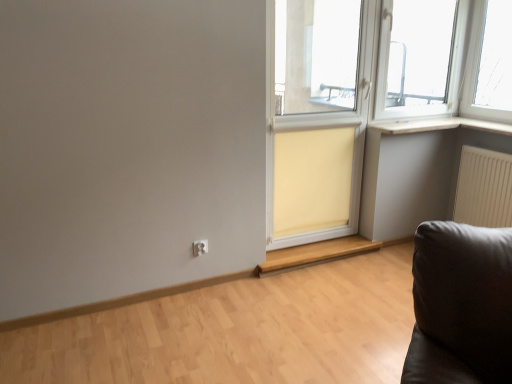
Question: Would you say beige fabric curtain at center is inside or outside white plastic electric outlet at lower center?

Choices:
 (A) outside
 (B) inside

Answer: (A)

Question: From the image's perspective, relative to white plastic electric outlet at lower center, is beige fabric curtain at center above or below?

Choices:
 (A) below
 (B) above

Answer: (B)

Question: Estimate the real-world distances between objects in this image. Which object is closer to the beige fabric curtain at center?

Choices:
 (A) beige fabric screen door at center
 (B) white plastic electric outlet at lower center
 (C) matte wood window sill at lower center
 (D) white matte wood at upper right

Answer: (A)

Question: Considering the real-world distances, which object is farthest from the white plastic electric outlet at lower center?

Choices:
 (A) white matte wood at upper right
 (B) matte wood window sill at lower center
 (C) beige fabric curtain at center
 (D) beige fabric screen door at center

Answer: (A)